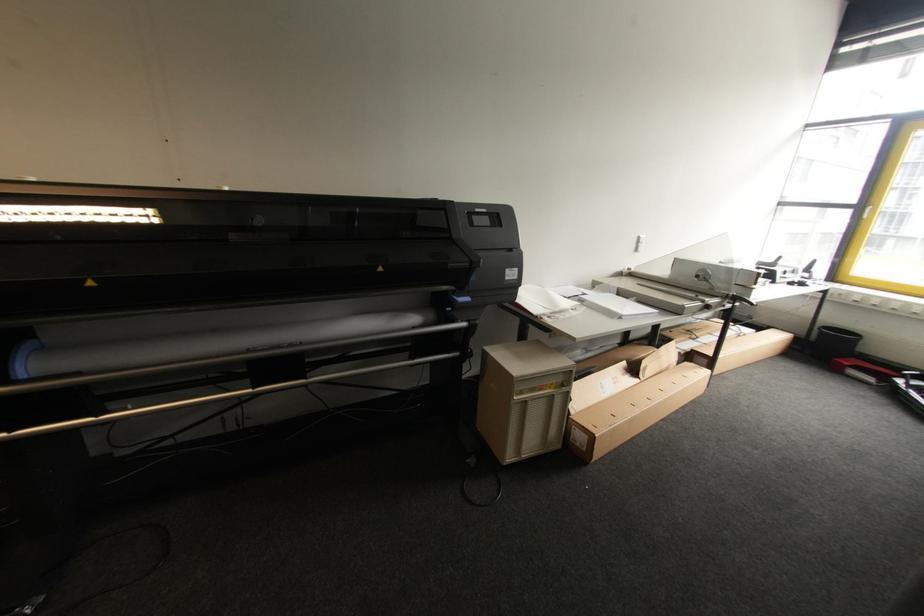
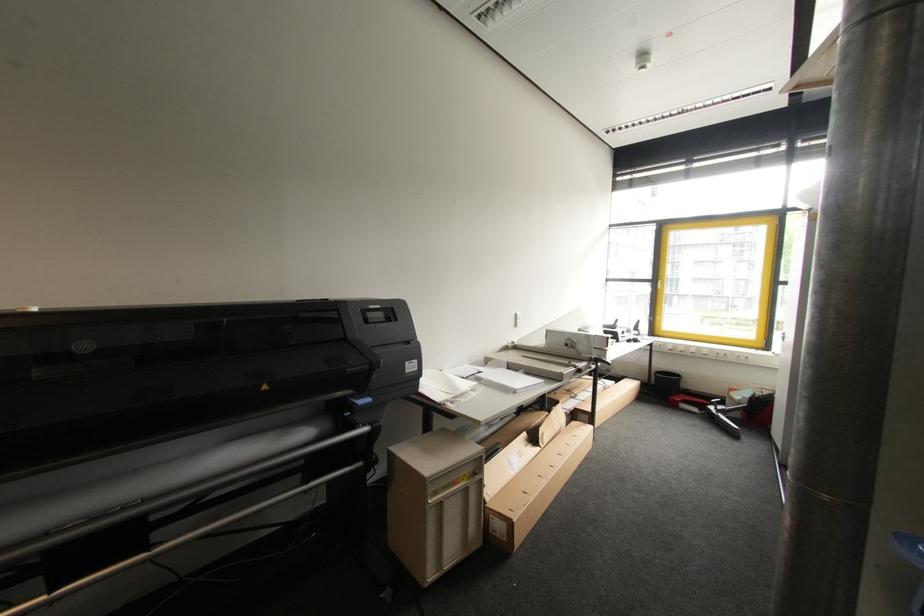
In the second image, find the point that corresponds to pixel 733 294 in the first image.

(594, 359)